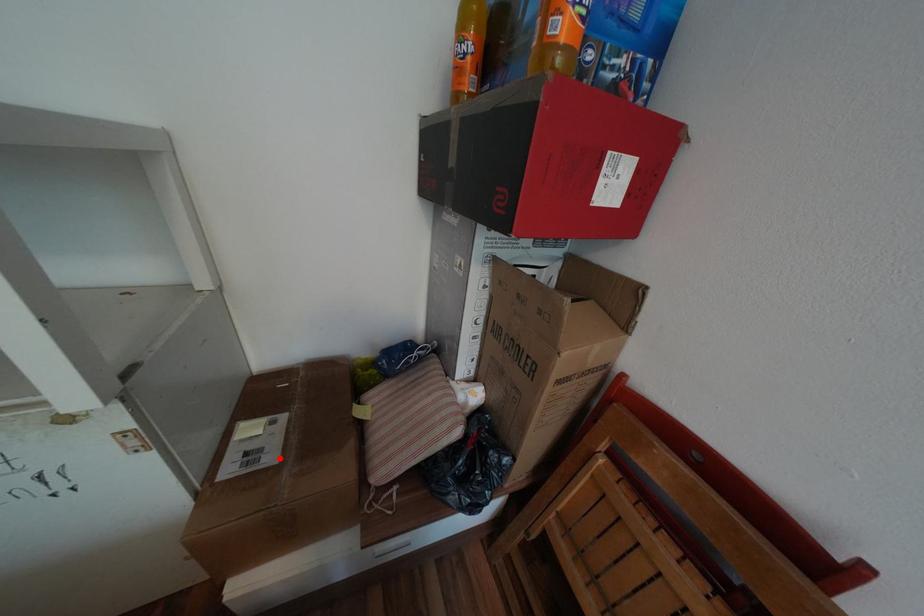
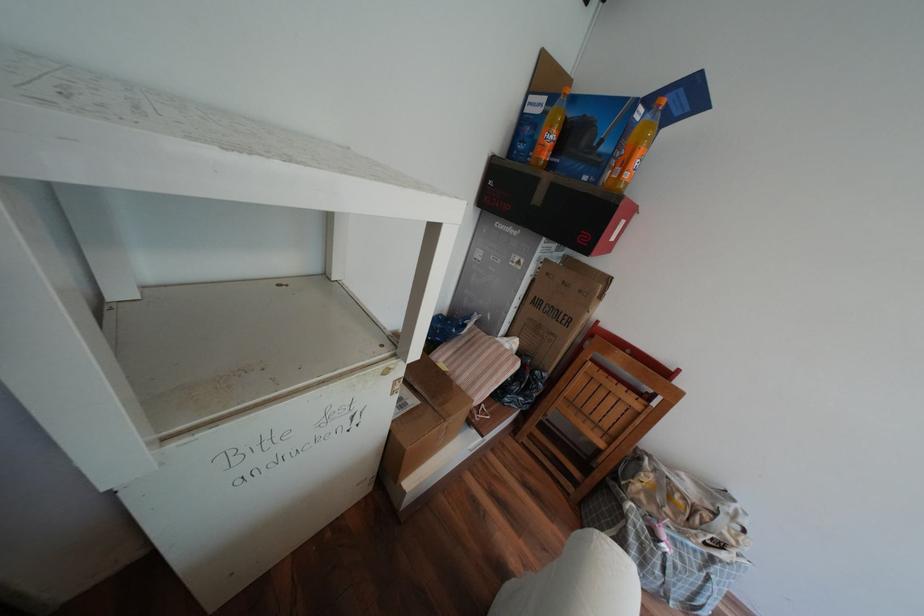
Locate, in the second image, the point that corresponds to the highlighted location in the first image.

(422, 400)